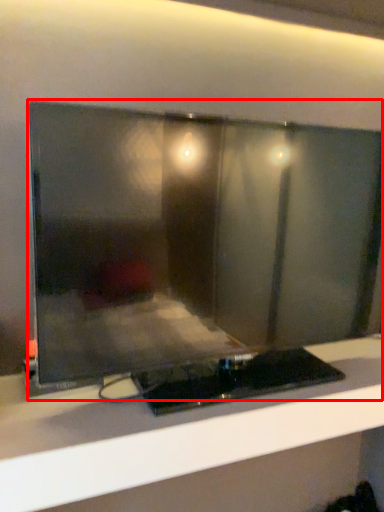
Question: Where is computer monitor (annotated by the red box) located in relation to furniture in the image?

Choices:
 (A) right
 (B) left

Answer: (B)